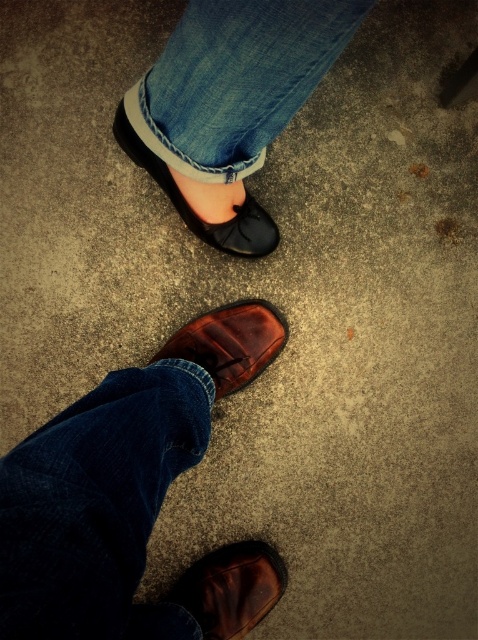
Question: Considering the real-world distances, which object is closest to the denim at center?

Choices:
 (A) brown leather shoe at lower center
 (B) shiny brown leather shoe at lower center
 (C) matte black shoe at center

Answer: (C)

Question: Observing the image, what is the correct spatial positioning of dark blue denim jeans at lower left in reference to shiny brown leather shoe at lower center?

Choices:
 (A) above
 (B) below

Answer: (B)

Question: Is dark blue denim jeans at lower left positioned behind matte black shoe at center?

Choices:
 (A) yes
 (B) no

Answer: (B)

Question: Among these points, which one is farthest from the camera?

Choices:
 (A) (213, 154)
 (B) (254, 216)
 (C) (257, 333)
 (D) (147, 474)

Answer: (B)

Question: Which point is closer to the camera taking this photo?

Choices:
 (A) (239, 321)
 (B) (69, 460)

Answer: (B)

Question: Observing the image, what is the correct spatial positioning of dark blue denim jeans at lower left in reference to brown leather shoe at lower center?

Choices:
 (A) left
 (B) right

Answer: (A)